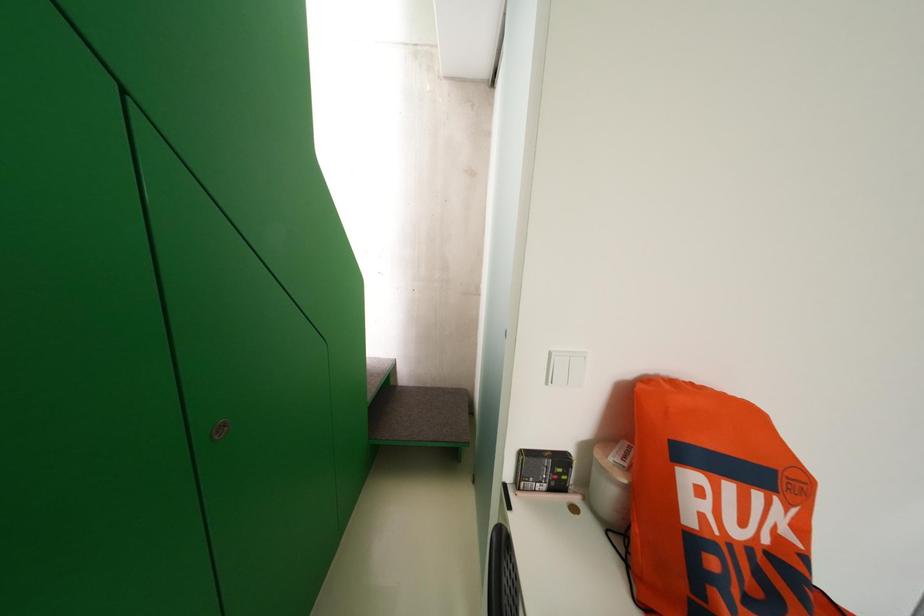
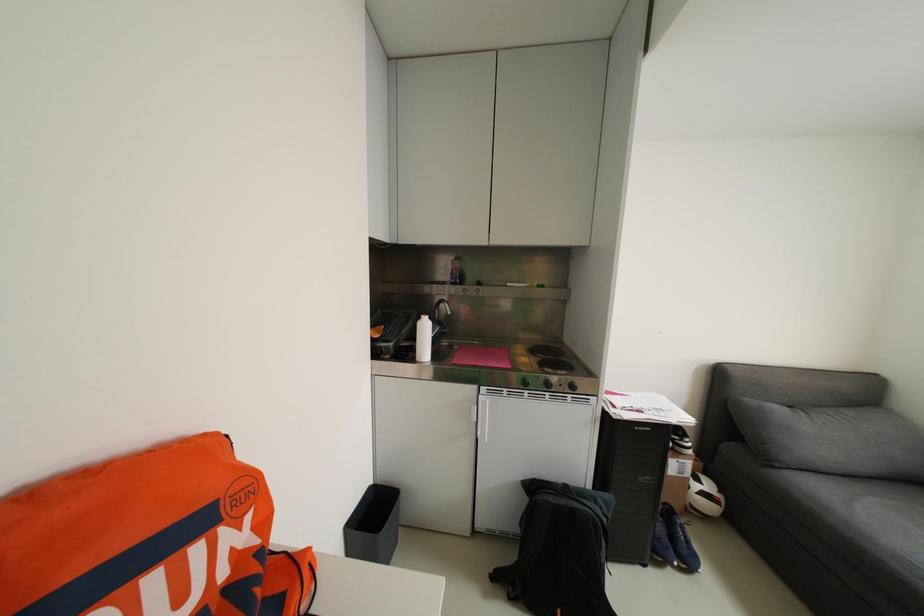
Question: The camera is either moving clockwise (left) or counter-clockwise (right) around the object. The first image is from the beginning of the video and the second image is from the end. Is the camera moving left or right when shooting the video?

Choices:
 (A) Left
 (B) Right

Answer: (A)